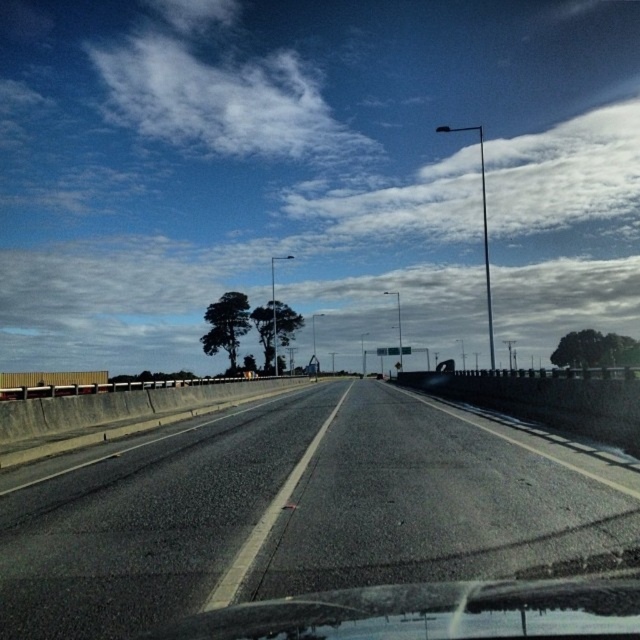
Question: Is black asphalt highway at center thinner than transparent glass windshield at lower center?

Choices:
 (A) no
 (B) yes

Answer: (A)

Question: Is black asphalt highway at center bigger than transparent glass windshield at lower center?

Choices:
 (A) no
 (B) yes

Answer: (B)

Question: Can you confirm if black asphalt highway at center is bigger than transparent glass windshield at lower center?

Choices:
 (A) yes
 (B) no

Answer: (A)

Question: Which point is closer to the camera?

Choices:
 (A) (362, 516)
 (B) (321, 621)

Answer: (B)